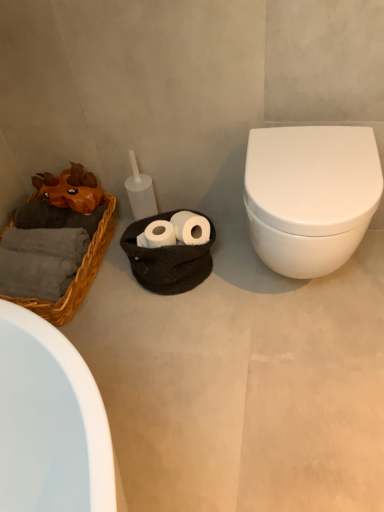
Where is `vacant space situated above white glossy toilet at right (from a real-world perspective)`? vacant space situated above white glossy toilet at right (from a real-world perspective) is located at coordinates (322, 163).